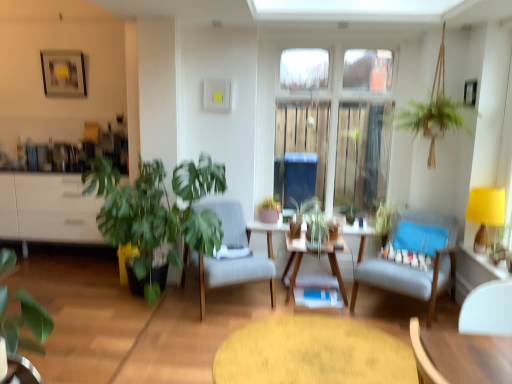
Question: Does yellow fabric lampshade at right have a larger size compared to light blue fabric chair at center right, which appears as the second chair when viewed from the left?

Choices:
 (A) no
 (B) yes

Answer: (A)

Question: Can you confirm if yellow fabric lampshade at right is taller than light blue fabric chair at center right, which is counted as the first chair, starting from the right?

Choices:
 (A) no
 (B) yes

Answer: (A)

Question: Is yellow fabric lampshade at right wider than light blue fabric chair at center right, which appears as the second chair when viewed from the left?

Choices:
 (A) no
 (B) yes

Answer: (A)

Question: Can you confirm if yellow fabric lampshade at right is thinner than light blue fabric chair at center right, which appears as the second chair when viewed from the left?

Choices:
 (A) yes
 (B) no

Answer: (A)

Question: Can you confirm if yellow fabric lampshade at right is shorter than light blue fabric chair at center right, which appears as the second chair when viewed from the left?

Choices:
 (A) yes
 (B) no

Answer: (A)

Question: Is yellow fabric lampshade at right turned away from light blue fabric chair at center right, which is counted as the first chair, starting from the right?

Choices:
 (A) no
 (B) yes

Answer: (A)

Question: From a real-world perspective, is light blue fabric chair at center right, which appears as the second chair when viewed from the left, on top of white glossy cabinet at left?

Choices:
 (A) no
 (B) yes

Answer: (A)

Question: Would you say light blue fabric chair at center right, which appears as the second chair when viewed from the left, is outside white glossy cabinet at left?

Choices:
 (A) yes
 (B) no

Answer: (A)

Question: Can you confirm if light blue fabric chair at center right, which is counted as the first chair, starting from the right, is positioned to the left of white glossy cabinet at left?

Choices:
 (A) yes
 (B) no

Answer: (B)

Question: From a real-world perspective, is light blue fabric chair at center right, which is counted as the first chair, starting from the right, beneath white glossy cabinet at left?

Choices:
 (A) no
 (B) yes

Answer: (B)

Question: Is the depth of light blue fabric chair at center right, which is counted as the first chair, starting from the right, greater than that of white glossy cabinet at left?

Choices:
 (A) yes
 (B) no

Answer: (B)

Question: Could you tell me if light blue fabric chair at center right, which is counted as the first chair, starting from the right, is facing white glossy cabinet at left?

Choices:
 (A) no
 (B) yes

Answer: (A)

Question: Does green matte plant at lower left, which ranks as the first houseplant in front-to-back order, have a greater height compared to green leafy plant at left, marked as the 2th houseplant in a left-to-right arrangement?

Choices:
 (A) yes
 (B) no

Answer: (B)